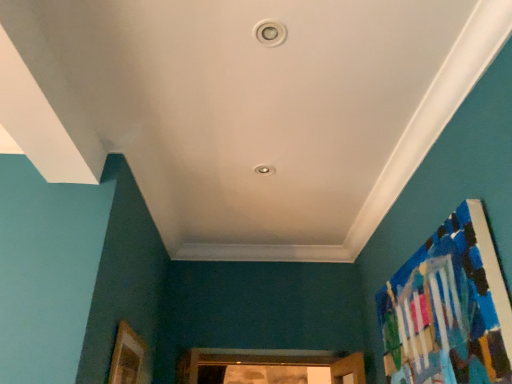
Question: Considering the positions of point (121, 329) and point (418, 347), is point (121, 329) closer or farther from the camera than point (418, 347)?

Choices:
 (A) farther
 (B) closer

Answer: (A)

Question: Considering the positions of wooden picture frame at lower left and painted wood bulletin board at right in the image, is wooden picture frame at lower left bigger or smaller than painted wood bulletin board at right?

Choices:
 (A) small
 (B) big

Answer: (A)

Question: Considering the relative positions of wooden picture frame at lower left and painted wood bulletin board at right in the image provided, is wooden picture frame at lower left to the left or to the right of painted wood bulletin board at right?

Choices:
 (A) right
 (B) left

Answer: (B)

Question: From a real-world perspective, is painted wood bulletin board at right above or below wooden picture frame at lower left?

Choices:
 (A) below
 (B) above

Answer: (B)

Question: Relative to wooden picture frame at lower left, is painted wood bulletin board at right in front or behind?

Choices:
 (A) front
 (B) behind

Answer: (A)

Question: Would you say painted wood bulletin board at right is inside or outside wooden picture frame at lower left?

Choices:
 (A) outside
 (B) inside

Answer: (A)

Question: Considering the positions of painted wood bulletin board at right and wooden picture frame at lower left in the image, is painted wood bulletin board at right wider or thinner than wooden picture frame at lower left?

Choices:
 (A) wide
 (B) thin

Answer: (A)